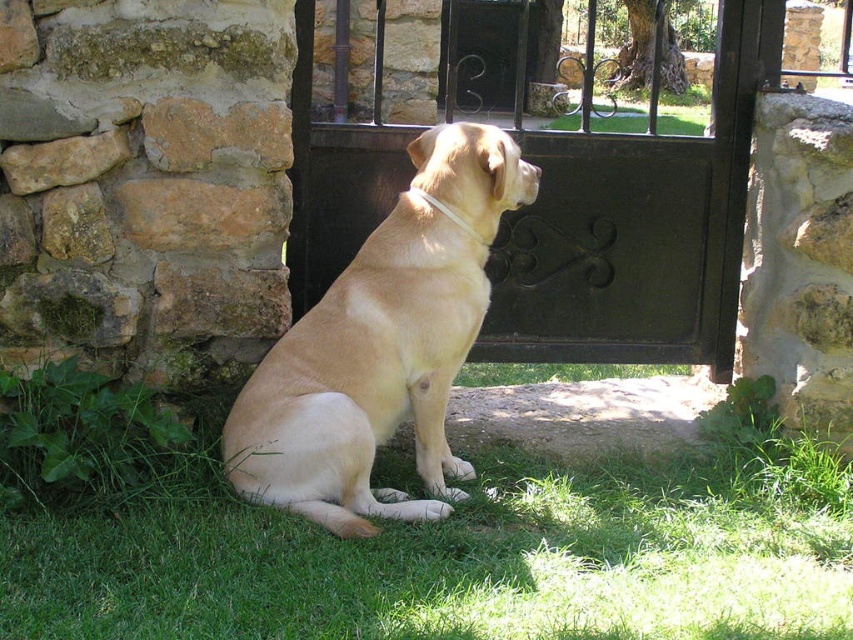
Between point (657, 172) and point (305, 339), which one is positioned in front?

Point (305, 339) is more forward.

Can you confirm if black wrought iron gate at center is shorter than golden fur dog at center?

In fact, black wrought iron gate at center may be taller than golden fur dog at center.

Is point (305, 35) closer to viewer compared to point (450, 374)?

No, it is behind (450, 374).

Identify the location of black wrought iron gate at center. (631, 236).

Is green grass at lower center above golden fur dog at center?

No.

Is point (730, 435) less distant than point (480, 195)?

No.

Between point (718, 481) and point (351, 481), which one is positioned in front?

Point (351, 481) is in front.

Find the location of a particular element. green grass at lower center is located at coordinates (x=444, y=552).

Is green grass at lower center to the left of black wrought iron gate at center from the viewer's perspective?

Indeed, green grass at lower center is positioned on the left side of black wrought iron gate at center.

Between point (178, 570) and point (680, 192), which one is positioned in front?

Point (178, 570) is more forward.

Does point (795, 499) come in front of point (712, 170)?

Yes, point (795, 499) is closer to viewer.

The image size is (853, 640). I want to click on green grass at lower center, so click(444, 552).